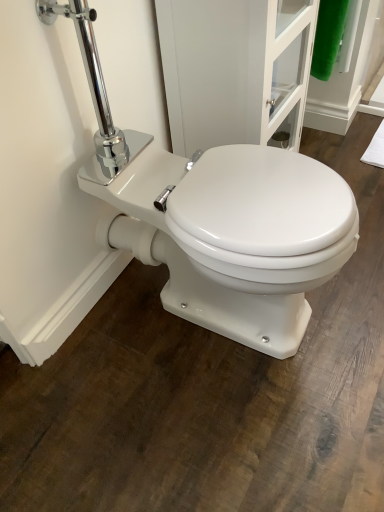
This screenshot has width=384, height=512. Identify the location of white glossy screen door at center. (235, 69).

This screenshot has height=512, width=384. What do you see at coordinates (235, 69) in the screenshot?
I see `white glossy screen door at center` at bounding box center [235, 69].

In order to face white glossy screen door at center, should I rotate leftwards or rightwards?

To align with it, rotate right about 6.161°.

What do you see at coordinates (234, 234) in the screenshot? Image resolution: width=384 pixels, height=512 pixels. I see `white glossy toilet at center` at bounding box center [234, 234].

This screenshot has width=384, height=512. Identify the location of white glossy toilet at center. (234, 234).

Identify the location of white glossy screen door at center. The width and height of the screenshot is (384, 512). (235, 69).

Between white glossy toilet at center and white glossy screen door at center, which one appears on the left side from the viewer's perspective?

white glossy toilet at center.

Is white glossy toilet at center closer to camera compared to white glossy screen door at center?

That is True.

Considering the points (263, 150) and (311, 57), which point is behind, point (263, 150) or point (311, 57)?

The point (311, 57) is farther from the camera.

From the image's perspective, does white glossy toilet at center appear higher than white glossy screen door at center?

No, from the image's perspective, white glossy toilet at center is not on top of white glossy screen door at center.

From a real-world perspective, is white glossy toilet at center located beneath white glossy screen door at center?

Yes, from a real-world perspective, white glossy toilet at center is beneath white glossy screen door at center.

Considering the sizes of objects white glossy toilet at center and white glossy screen door at center in the image provided, who is wider, white glossy toilet at center or white glossy screen door at center?

white glossy toilet at center is wider.

Which of these two, white glossy toilet at center or white glossy screen door at center, stands shorter?

Standing shorter between the two is white glossy toilet at center.

Can you confirm if white glossy toilet at center is bigger than white glossy screen door at center?

Correct, white glossy toilet at center is larger in size than white glossy screen door at center.

Would you say white glossy toilet at center is outside white glossy screen door at center?

Yes, white glossy toilet at center is outside of white glossy screen door at center.

Is white glossy toilet at center directly adjacent to white glossy screen door at center?

No, white glossy toilet at center is not in contact with white glossy screen door at center.

Could you tell me if white glossy toilet at center is facing white glossy screen door at center?

No, white glossy toilet at center is not oriented towards white glossy screen door at center.

Where is `toilet below the white glossy screen door at center (from the image's perspective)`? toilet below the white glossy screen door at center (from the image's perspective) is located at coordinates (234, 234).

Considering the relative positions of white glossy screen door at center and white glossy toilet at center in the image provided, is white glossy screen door at center to the left or to the right of white glossy toilet at center?

Based on their positions, white glossy screen door at center is located to the right of white glossy toilet at center.

Does white glossy screen door at center come in front of white glossy toilet at center?

That is False.

Does point (207, 11) come farther from viewer compared to point (333, 245)?

Yes.

From the image's perspective, is white glossy screen door at center located above or below white glossy toilet at center?

white glossy screen door at center is situated higher than white glossy toilet at center in the image.

From a real-world perspective, between white glossy screen door at center and white glossy toilet at center, who is vertically higher?

In real-world perspective, white glossy screen door at center is above.

Considering the sizes of white glossy screen door at center and white glossy toilet at center in the image, is white glossy screen door at center wider or thinner than white glossy toilet at center?

white glossy screen door at center is thinner than white glossy toilet at center.

Is white glossy screen door at center shorter than white glossy toilet at center?

Incorrect, the height of white glossy screen door at center does not fall short of that of white glossy toilet at center.

Considering the sizes of objects white glossy screen door at center and white glossy toilet at center in the image provided, who is bigger, white glossy screen door at center or white glossy toilet at center?

With larger size is white glossy toilet at center.

Is white glossy screen door at center positioned beyond the bounds of white glossy toilet at center?

Yes, white glossy screen door at center is not within white glossy toilet at center.

Are white glossy screen door at center and white glossy toilet at center far apart?

Actually, white glossy screen door at center and white glossy toilet at center are a little close together.

Could you tell me if white glossy screen door at center is facing white glossy toilet at center?

No, white glossy screen door at center does not turn towards white glossy toilet at center.

Find the location of a particular element. screen door above the white glossy toilet at center (from the image's perspective) is located at coordinates click(x=235, y=69).

Identify the location of toilet below the white glossy screen door at center (from the image's perspective). (234, 234).

Locate an element on the screen. This screenshot has height=512, width=384. screen door that is above the white glossy toilet at center (from the image's perspective) is located at coordinates (235, 69).